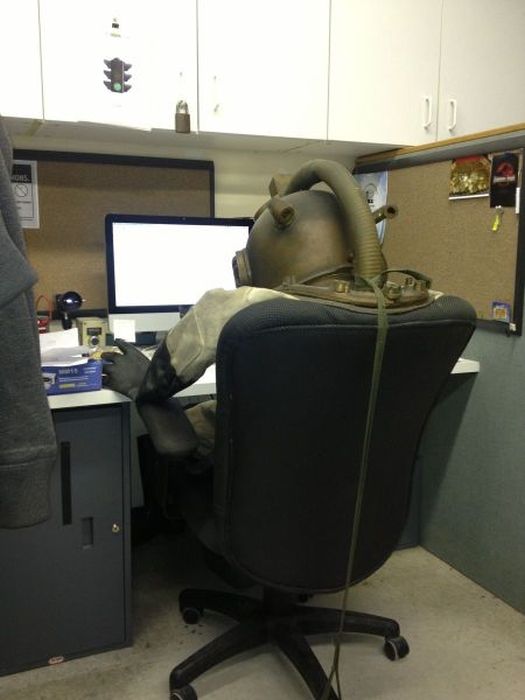
Locate an element on the screen. The image size is (525, 700). chair wheel is located at coordinates (197, 615), (187, 689), (397, 648).